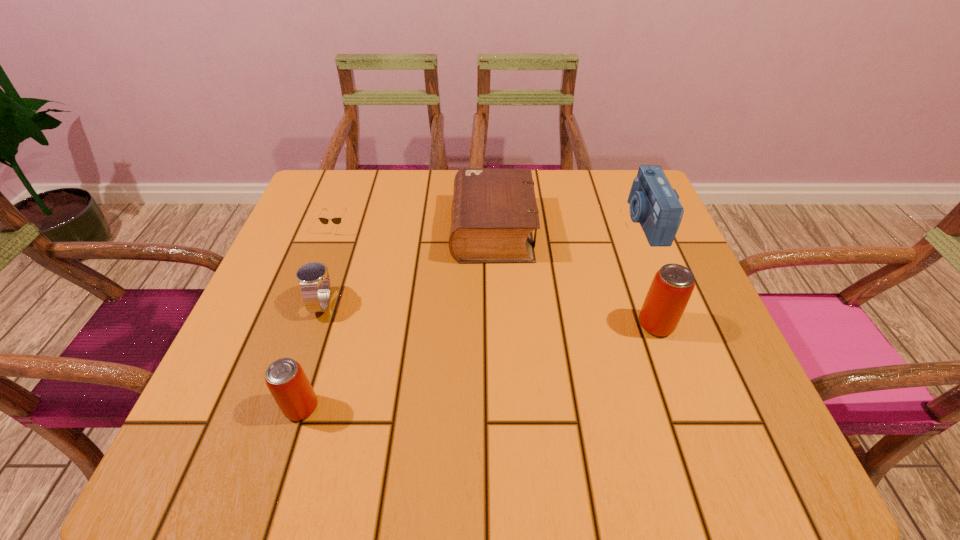
I want to click on the nearest object, so click(x=286, y=380).

The height and width of the screenshot is (540, 960). I want to click on the nearer beer can, so click(x=286, y=380).

At what (x,y) coordinates should I click in order to perform the action: click on the right beer can. Please return your answer as a coordinate pair (x, y). This screenshot has height=540, width=960. Looking at the image, I should click on (672, 286).

This screenshot has width=960, height=540. Identify the location of the farther beer can. (672, 286).

In order to click on Bible in this screenshot , I will do `click(494, 211)`.

Locate an element on the screen. This screenshot has width=960, height=540. camera is located at coordinates (654, 204).

This screenshot has height=540, width=960. What are the coordinates of `the shortest object` in the screenshot? It's located at (337, 220).

Identify the location of watch. The height and width of the screenshot is (540, 960). (314, 280).

At what (x,y) coordinates should I click in order to perform the action: click on vacant region located on the right of the nearest object. Please return your answer as a coordinate pair (x, y). The image size is (960, 540). Looking at the image, I should click on (504, 408).

Where is `vacant region located on the back of the right beer can`? Image resolution: width=960 pixels, height=540 pixels. vacant region located on the back of the right beer can is located at coordinates click(637, 273).